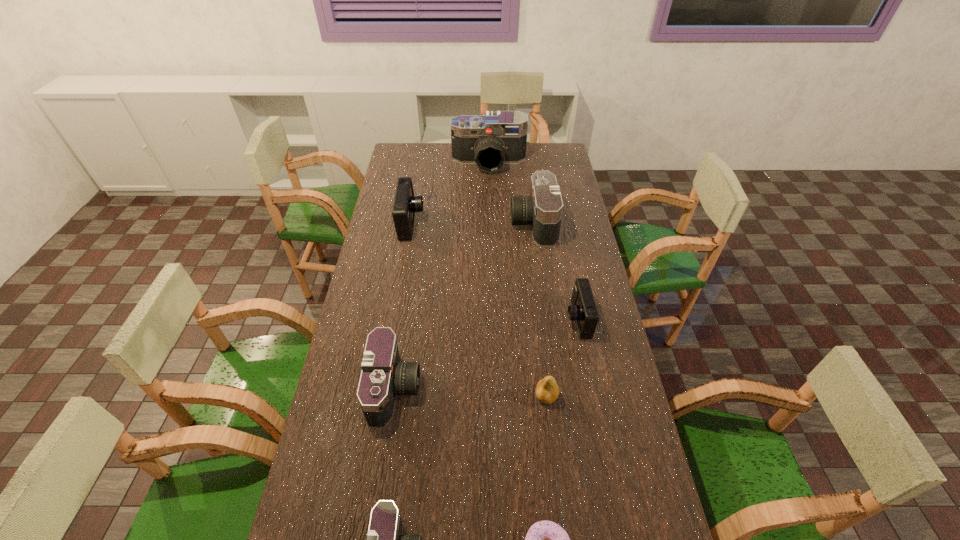
At what (x,y) coordinates should I click in order to perform the action: click on the farthest object. Please return your answer as a coordinate pair (x, y). Looking at the image, I should click on (498, 137).

Locate an element on the screen. The image size is (960, 540). the farthest black camera is located at coordinates 498,137.

Where is `the third nearest black camera`? The width and height of the screenshot is (960, 540). the third nearest black camera is located at coordinates (543, 209).

This screenshot has height=540, width=960. What are the coordinates of `the farther blue camera` in the screenshot? It's located at (405, 205).

At what (x,y) coordinates should I click in order to perform the action: click on the left blue camera. Please return your answer as a coordinate pair (x, y). Image resolution: width=960 pixels, height=540 pixels. Looking at the image, I should click on (405, 205).

Image resolution: width=960 pixels, height=540 pixels. In order to click on the fifth farthest camera in this screenshot , I will do `click(383, 376)`.

I want to click on the third farthest black camera, so click(383, 376).

The image size is (960, 540). Identify the location of pear. tap(547, 390).

Identify the location of the third nearest camera. 583,310.

Identify the location of the nearer blue camera. The image size is (960, 540). (583, 310).